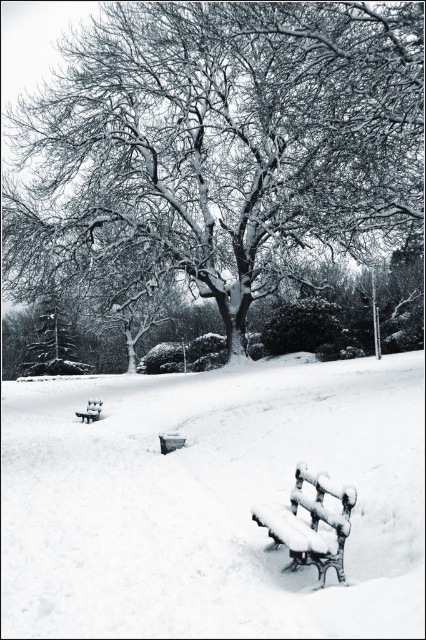
Does snow-covered tree at center have a smaller size compared to snow-covered wooden bench at lower center?

Actually, snow-covered tree at center might be larger than snow-covered wooden bench at lower center.

Is snow-covered tree at center above snow-covered wooden bench at lower center?

Yes, snow-covered tree at center is above snow-covered wooden bench at lower center.

Identify the location of snow-covered tree at center. The height and width of the screenshot is (640, 426). (219, 141).

You are a GUI agent. You are given a task and a screenshot of the screen. Output one action in this format:
    pyautogui.click(x=<x>, y=<y>)
    Task: Click on the snow-covered tree at center
    
    Given the screenshot: What is the action you would take?
    pyautogui.click(x=219, y=141)

Between snow-covered tree at center and white frosted bench at lower right, which one appears on the right side from the viewer's perspective?

snow-covered tree at center is more to the right.

Describe the element at coordinates (219, 141) in the screenshot. The image size is (426, 640). I see `snow-covered tree at center` at that location.

Image resolution: width=426 pixels, height=640 pixels. What do you see at coordinates (219, 141) in the screenshot?
I see `snow-covered tree at center` at bounding box center [219, 141].

I want to click on snow-covered tree at center, so click(219, 141).

In the scene shown: Which is more to the right, snow-covered tree at center or snow-covered wood bench at lower center?

snow-covered wood bench at lower center is more to the right.

Which is in front, point (143, 237) or point (325, 547)?

Point (325, 547)

Measure the distance between point (307, 49) and camera.

14.84 meters

Identify the location of snow-covered tree at center. (219, 141).